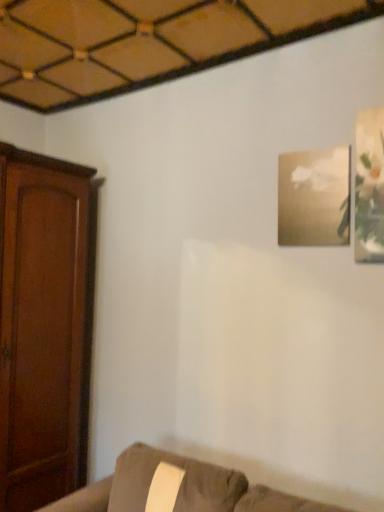
The height and width of the screenshot is (512, 384). I want to click on gold textured frame at upper right, the 1th picture frame positioned from the left, so click(x=314, y=197).

Locate an element on the screen. This screenshot has height=512, width=384. gold textured frame at upper right, the second picture frame in the right-to-left sequence is located at coordinates (314, 197).

Which is in front, point (356, 239) or point (66, 496)?

The point (356, 239) is more forward.

Considering the sizes of objects matte white frame at upper right, which is the first picture frame in right-to-left order, and suede couch at lower right in the image provided, who is bigger, matte white frame at upper right, which is the first picture frame in right-to-left order, or suede couch at lower right?

suede couch at lower right is bigger.

Is matte white frame at upper right, the 2th picture frame viewed from the back, facing away from suede couch at lower right?

That's not correct — matte white frame at upper right, the 2th picture frame viewed from the back, is not looking away from suede couch at lower right.

From a real-world perspective, is matte white frame at upper right, which ranks as the 2th picture frame in left-to-right order, physically located above or below suede couch at lower right?

From a real-world perspective, matte white frame at upper right, which ranks as the 2th picture frame in left-to-right order, is physically above suede couch at lower right.

Between gold textured frame at upper right, the 1th picture frame positioned from the left, and matte white frame at upper right, which is the first picture frame in right-to-left order, which one has smaller size?

matte white frame at upper right, which is the first picture frame in right-to-left order, is smaller.

Which object is further away from the camera, gold textured frame at upper right, placed as the first picture frame when sorted from back to front, or matte white frame at upper right, which is the first picture frame in right-to-left order?

gold textured frame at upper right, placed as the first picture frame when sorted from back to front, is behind.

Could you tell me if gold textured frame at upper right, the second picture frame in the right-to-left sequence, is facing matte white frame at upper right, which ranks as the 2th picture frame in left-to-right order?

No.

Considering the positions of objects gold textured frame at upper right, the second picture frame in the right-to-left sequence, and matte white frame at upper right, which ranks as the 2th picture frame in left-to-right order, in the image provided, who is more to the left, gold textured frame at upper right, the second picture frame in the right-to-left sequence, or matte white frame at upper right, which ranks as the 2th picture frame in left-to-right order,?

gold textured frame at upper right, the second picture frame in the right-to-left sequence.

Is there a large distance between matte white frame at upper right, positioned as the first picture frame in front-to-back order, and gold textured frame at upper right, the 1th picture frame positioned from the left?

That's not correct — matte white frame at upper right, positioned as the first picture frame in front-to-back order, is a little close to gold textured frame at upper right, the 1th picture frame positioned from the left.

Can you confirm if matte white frame at upper right, positioned as the first picture frame in front-to-back order, is bigger than gold textured frame at upper right, positioned as the second picture frame in front-to-back order?

No, matte white frame at upper right, positioned as the first picture frame in front-to-back order, is not bigger than gold textured frame at upper right, positioned as the second picture frame in front-to-back order.

In the image, is matte white frame at upper right, the 2th picture frame viewed from the back, positioned in front of or behind gold textured frame at upper right, positioned as the second picture frame in front-to-back order?

Visually, matte white frame at upper right, the 2th picture frame viewed from the back, is located in front of gold textured frame at upper right, positioned as the second picture frame in front-to-back order.

Can you confirm if matte white frame at upper right, positioned as the first picture frame in front-to-back order, is wider than gold textured frame at upper right, the 1th picture frame positioned from the left?

No.

Does suede couch at lower right appear on the left side of gold textured frame at upper right, the second picture frame in the right-to-left sequence?

Correct, you'll find suede couch at lower right to the left of gold textured frame at upper right, the second picture frame in the right-to-left sequence.

Is suede couch at lower right directly adjacent to gold textured frame at upper right, placed as the first picture frame when sorted from back to front?

No, suede couch at lower right is not beside gold textured frame at upper right, placed as the first picture frame when sorted from back to front.

From the image's perspective, does suede couch at lower right appear lower than gold textured frame at upper right, positioned as the second picture frame in front-to-back order?

Indeed, from the image's perspective, suede couch at lower right is shown beneath gold textured frame at upper right, positioned as the second picture frame in front-to-back order.

Between suede couch at lower right and gold textured frame at upper right, the 1th picture frame positioned from the left, which one is positioned in front?

suede couch at lower right.

Is suede couch at lower right placed right next to matte white frame at upper right, the 2th picture frame viewed from the back?

There is a gap between suede couch at lower right and matte white frame at upper right, the 2th picture frame viewed from the back.

Is suede couch at lower right thinner than matte white frame at upper right, which ranks as the 2th picture frame in left-to-right order?

Incorrect, the width of suede couch at lower right is not less than that of matte white frame at upper right, which ranks as the 2th picture frame in left-to-right order.

Can matte white frame at upper right, which ranks as the 2th picture frame in left-to-right order, be found inside suede couch at lower right?

No, matte white frame at upper right, which ranks as the 2th picture frame in left-to-right order, is located outside of suede couch at lower right.

From the image's perspective, count 2nd picture frames upward from the suede couch at lower right and point to it. Please provide its 2D coordinates.

[(369, 186)]

Consider the image. How much distance is there between gold textured frame at upper right, placed as the first picture frame when sorted from back to front, and suede couch at lower right?

gold textured frame at upper right, placed as the first picture frame when sorted from back to front, is 3.88 feet from suede couch at lower right.

I want to click on the 1st picture frame to the right of the suede couch at lower right, counting from the anchor's position, so click(x=314, y=197).

Can you confirm if gold textured frame at upper right, placed as the first picture frame when sorted from back to front, is thinner than suede couch at lower right?

Indeed, gold textured frame at upper right, placed as the first picture frame when sorted from back to front, has a lesser width compared to suede couch at lower right.

Is suede couch at lower right at the back of gold textured frame at upper right, positioned as the second picture frame in front-to-back order?

No, gold textured frame at upper right, positioned as the second picture frame in front-to-back order, is not facing away from suede couch at lower right.

Locate an element on the screen. the 1st picture frame behind the suede couch at lower right, counting from the anchor's position is located at coordinates (369, 186).

Locate an element on the screen. picture frame above the gold textured frame at upper right, placed as the first picture frame when sorted from back to front (from the image's perspective) is located at coordinates [369, 186].

Looking at the image, which one is located further to suede couch at lower right, matte white frame at upper right, which ranks as the 2th picture frame in left-to-right order, or gold textured frame at upper right, the 1th picture frame positioned from the left?

The object further to suede couch at lower right is matte white frame at upper right, which ranks as the 2th picture frame in left-to-right order.

Looking at this image, considering their positions, is matte white frame at upper right, the 2th picture frame viewed from the back, positioned closer to gold textured frame at upper right, positioned as the second picture frame in front-to-back order, than suede couch at lower right?

Among the two, matte white frame at upper right, the 2th picture frame viewed from the back, is located nearer to gold textured frame at upper right, positioned as the second picture frame in front-to-back order.

When comparing their distances from suede couch at lower right, does gold textured frame at upper right, the 1th picture frame positioned from the left, or matte white frame at upper right, which ranks as the 2th picture frame in left-to-right order, seem further?

The object further to suede couch at lower right is matte white frame at upper right, which ranks as the 2th picture frame in left-to-right order.

Estimate the real-world distances between objects in this image. Which object is closer to gold textured frame at upper right, placed as the first picture frame when sorted from back to front, suede couch at lower right or matte white frame at upper right, the 2th picture frame viewed from the back?

The object closer to gold textured frame at upper right, placed as the first picture frame when sorted from back to front, is matte white frame at upper right, the 2th picture frame viewed from the back.

Consider the image. Considering their positions, is suede couch at lower right positioned closer to matte white frame at upper right, which is the first picture frame in right-to-left order, than gold textured frame at upper right, placed as the first picture frame when sorted from back to front?

gold textured frame at upper right, placed as the first picture frame when sorted from back to front, is closer to matte white frame at upper right, which is the first picture frame in right-to-left order.

Based on their spatial positions, is gold textured frame at upper right, positioned as the second picture frame in front-to-back order, or suede couch at lower right further from matte white frame at upper right, which is the first picture frame in right-to-left order?

suede couch at lower right lies further to matte white frame at upper right, which is the first picture frame in right-to-left order, than the other object.

Image resolution: width=384 pixels, height=512 pixels. I want to click on picture frame between matte white frame at upper right, which ranks as the 2th picture frame in left-to-right order, and suede couch at lower right vertically, so click(x=314, y=197).